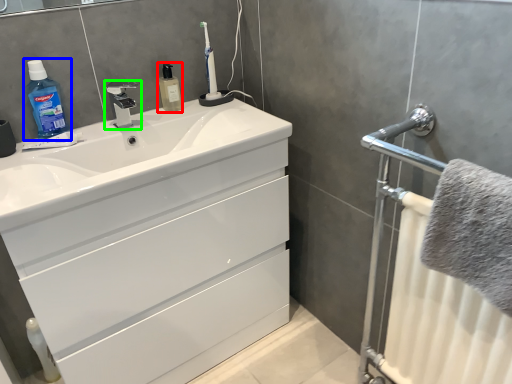
Question: Which is farther away from mouthwash (highlighted by a red box)? cleaning product (highlighted by a blue box) or tap (highlighted by a green box)?

Choices:
 (A) cleaning product
 (B) tap

Answer: (A)